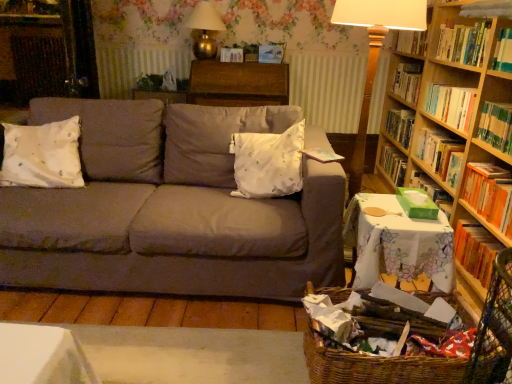
Identify the location of free spot in front of hardcover book at center, which ranks as the 1th paperback book in left-to-right order. (227, 63).